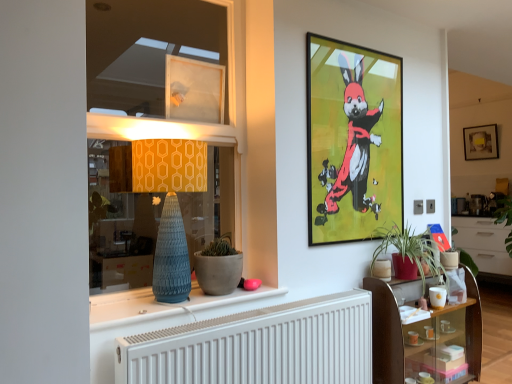
What do you see at coordinates (154, 104) in the screenshot? The height and width of the screenshot is (384, 512). I see `matte yellow fabric at left` at bounding box center [154, 104].

Where is `white matte flowerpot at lower right, the 2th flowerpot viewed from the left`? Image resolution: width=512 pixels, height=384 pixels. white matte flowerpot at lower right, the 2th flowerpot viewed from the left is located at coordinates (449, 259).

Measure the distance between point (450, 252) and camera.

Point (450, 252) is 2.44 meters from camera.

This screenshot has width=512, height=384. Identify the location of matte concrete pot at center, positioned as the 1th flowerpot in front-to-back order. (218, 272).

Find the location of a particular element. matte gold picture frame at upper right, which is counted as the first picture frame, starting from the right is located at coordinates (481, 142).

Considering the positions of objects transparent plastic window at upper center, the third picture frame in the right-to-left sequence, and matte gold picture frame at upper right, which is counted as the first picture frame, starting from the right, in the image provided, who is behind, transparent plastic window at upper center, the third picture frame in the right-to-left sequence, or matte gold picture frame at upper right, which is counted as the first picture frame, starting from the right,?

matte gold picture frame at upper right, which is counted as the first picture frame, starting from the right, is further away from the camera.

From a real-world perspective, between transparent plastic window at upper center, acting as the 3th picture frame starting from the back, and matte gold picture frame at upper right, the third picture frame when ordered from front to back, who is vertically higher?

matte gold picture frame at upper right, the third picture frame when ordered from front to back, from a real-world perspective.

From the picture: Is transparent plastic window at upper center, which is the 1th picture frame from left to right, to the left of matte gold picture frame at upper right, the third picture frame positioned from the left, from the viewer's perspective?

Correct, you'll find transparent plastic window at upper center, which is the 1th picture frame from left to right, to the left of matte gold picture frame at upper right, the third picture frame positioned from the left.

Would you say wooden glass shelf at lower right is inside or outside white matte radiator at lower center?

The correct answer is: outside.

From the image's perspective, is wooden glass shelf at lower right positioned above or below white matte radiator at lower center?

Clearly, from the image's perspective, wooden glass shelf at lower right is below white matte radiator at lower center.

Would you consider wooden glass shelf at lower right to be distant from white matte radiator at lower center?

No.

Is wooden glass shelf at lower right facing towards white matte radiator at lower center?

No, wooden glass shelf at lower right is not turned towards white matte radiator at lower center.

Would you say transparent plastic window at upper center, the third picture frame in the right-to-left sequence, is part of white matte flowerpot at lower right, the first flowerpot viewed from the back,'s contents?

Definitely not — transparent plastic window at upper center, the third picture frame in the right-to-left sequence, is not inside white matte flowerpot at lower right, the first flowerpot viewed from the back.

Considering the relative sizes of white matte flowerpot at lower right, the 2th flowerpot viewed from the left, and transparent plastic window at upper center, acting as the first picture frame starting from the front, in the image provided, is white matte flowerpot at lower right, the 2th flowerpot viewed from the left, bigger than transparent plastic window at upper center, acting as the first picture frame starting from the front,?

No, white matte flowerpot at lower right, the 2th flowerpot viewed from the left, is not bigger than transparent plastic window at upper center, acting as the first picture frame starting from the front.

Does white matte flowerpot at lower right, the first flowerpot viewed from the back, lie behind transparent plastic window at upper center, the third picture frame in the right-to-left sequence?

Yes, it is behind transparent plastic window at upper center, the third picture frame in the right-to-left sequence.

Considering the points (448, 268) and (214, 103), which point is behind, point (448, 268) or point (214, 103)?

Point (448, 268)

Is metallic-framed artwork at upper center, which is the second picture frame in left-to-right order, aimed at transparent plastic window at upper center, acting as the first picture frame starting from the front?

No, metallic-framed artwork at upper center, which is the second picture frame in left-to-right order, is not oriented towards transparent plastic window at upper center, acting as the first picture frame starting from the front.

Where is `picture frame below the transparent plastic window at upper center, acting as the first picture frame starting from the front (from a real-world perspective)`? This screenshot has height=384, width=512. picture frame below the transparent plastic window at upper center, acting as the first picture frame starting from the front (from a real-world perspective) is located at coordinates (352, 140).

From the image's perspective, which one is positioned higher, metallic-framed artwork at upper center, the 2th picture frame from the front, or transparent plastic window at upper center, acting as the first picture frame starting from the front?

transparent plastic window at upper center, acting as the first picture frame starting from the front.

Considering their positions, is metallic-framed artwork at upper center, which is the second picture frame in left-to-right order, located in front of or behind transparent plastic window at upper center, acting as the 3th picture frame starting from the back?

metallic-framed artwork at upper center, which is the second picture frame in left-to-right order, is positioned farther from the viewer than transparent plastic window at upper center, acting as the 3th picture frame starting from the back.

Is point (136, 168) closer to camera compared to point (308, 111)?

Yes, it is in front of point (308, 111).

In terms of height, does matte yellow fabric at left look taller or shorter compared to metallic-framed artwork at upper center, the 2th picture frame from the front?

Considering their sizes, matte yellow fabric at left has more height than metallic-framed artwork at upper center, the 2th picture frame from the front.

Between matte yellow fabric at left and metallic-framed artwork at upper center, placed as the second picture frame when sorted from back to front, which one has smaller size?

metallic-framed artwork at upper center, placed as the second picture frame when sorted from back to front, is smaller.

Is metallic-framed artwork at upper center, which is the second picture frame in left-to-right order, at the back of matte yellow fabric at left?

matte yellow fabric at left does not have its back to metallic-framed artwork at upper center, which is the second picture frame in left-to-right order.

How many degrees apart are the facing directions of matte gold picture frame at upper right, the 1th picture frame in the back-to-front sequence, and white matte radiator at lower center?

89.4 degrees.

Can you confirm if matte gold picture frame at upper right, the third picture frame positioned from the left, is positioned to the right of white matte radiator at lower center?

Yes, matte gold picture frame at upper right, the third picture frame positioned from the left, is to the right of white matte radiator at lower center.

From the image's perspective, relative to white matte radiator at lower center, is matte gold picture frame at upper right, which is counted as the first picture frame, starting from the right, above or below?

From the image's perspective, matte gold picture frame at upper right, which is counted as the first picture frame, starting from the right, appears above white matte radiator at lower center.

Would you say matte gold picture frame at upper right, the third picture frame positioned from the left, is outside white matte radiator at lower center?

matte gold picture frame at upper right, the third picture frame positioned from the left, lies outside white matte radiator at lower center's area.

In terms of height, does matte blue vase at center look taller or shorter compared to matte concrete pot at center, positioned as the 1th flowerpot in front-to-back order?

Considering their sizes, matte blue vase at center has less height than matte concrete pot at center, positioned as the 1th flowerpot in front-to-back order.

Is matte blue vase at center next to matte concrete pot at center, which appears as the 2th flowerpot when viewed from the back?

No, matte blue vase at center is not with matte concrete pot at center, which appears as the 2th flowerpot when viewed from the back.

Can we say matte blue vase at center lies outside matte concrete pot at center, which appears as the 2th flowerpot when viewed from the back?

matte blue vase at center lies outside matte concrete pot at center, which appears as the 2th flowerpot when viewed from the back,'s area.

From a real-world perspective, is matte blue vase at center physically located above or below matte concrete pot at center, the 2th flowerpot when ordered from right to left?

Clearly, from a real-world perspective, matte blue vase at center is below matte concrete pot at center, the 2th flowerpot when ordered from right to left.

From a real-world perspective, starting from the matte gold picture frame at upper right, which is counted as the first picture frame, starting from the right, which picture frame is the 1st one below it? Please provide its 2D coordinates.

[(194, 90)]

You are a GUI agent. You are given a task and a screenshot of the screen. Output one action in this format:
    pyautogui.click(x=<x>, y=<y>)
    Task: Click on the radiator that is above the wooden glass shelf at lower right (from a real-world perspective)
    Image resolution: width=512 pixels, height=384 pixels.
    Given the screenshot: What is the action you would take?
    pyautogui.click(x=259, y=346)

Based on their spatial positions, is matte blue vase at center or matte concrete pot at center, positioned as the 1th flowerpot in front-to-back order, further from matte blue vase at center?

Based on the image, matte blue vase at center appears to be further to matte blue vase at center.

When comparing their distances from matte blue vase at center, does matte blue vase at center or matte gold picture frame at upper right, which is counted as the first picture frame, starting from the right, seem further?

matte gold picture frame at upper right, which is counted as the first picture frame, starting from the right.

When comparing their distances from white matte radiator at lower center, does wooden glass shelf at lower right or metallic-framed artwork at upper center, placed as the second picture frame when sorted from back to front, seem closer?

Among the two, metallic-framed artwork at upper center, placed as the second picture frame when sorted from back to front, is located nearer to white matte radiator at lower center.

Considering their positions, is white matte flowerpot at lower right, the first flowerpot viewed from the back, positioned closer to matte yellow fabric at left than matte concrete pot at center, positioned as the 1th flowerpot in front-to-back order?

The object closer to matte yellow fabric at left is matte concrete pot at center, positioned as the 1th flowerpot in front-to-back order.

Which object lies further to the anchor point transparent plastic window at upper center, the third picture frame in the right-to-left sequence, white matte radiator at lower center or matte yellow fabric at left?

white matte radiator at lower center is further to transparent plastic window at upper center, the third picture frame in the right-to-left sequence.

From the image, which object appears to be nearer to metallic-framed artwork at upper center, which is the second picture frame in left-to-right order, matte blue vase at center or white matte radiator at lower center?

white matte radiator at lower center lies closer to metallic-framed artwork at upper center, which is the second picture frame in left-to-right order, than the other object.

From the image, which object appears to be farther from matte blue vase at center, metallic-framed artwork at upper center, placed as the second picture frame when sorted from back to front, or matte concrete pot at center, which appears as the 2th flowerpot when viewed from the back?

metallic-framed artwork at upper center, placed as the second picture frame when sorted from back to front, lies further to matte blue vase at center than the other object.

Estimate the real-world distances between objects in this image. Which object is closer to matte blue vase at center, white matte flowerpot at lower right, which appears as the second flowerpot when viewed from the front, or matte gold picture frame at upper right, the 1th picture frame in the back-to-front sequence?

white matte flowerpot at lower right, which appears as the second flowerpot when viewed from the front.

Where is `bay window between transparent plastic window at upper center, acting as the 3th picture frame starting from the back, and matte concrete pot at center, the 2th flowerpot when ordered from right to left, from top to bottom`? This screenshot has width=512, height=384. bay window between transparent plastic window at upper center, acting as the 3th picture frame starting from the back, and matte concrete pot at center, the 2th flowerpot when ordered from right to left, from top to bottom is located at coordinates click(x=154, y=104).

The width and height of the screenshot is (512, 384). Find the location of `shelf located between transparent plastic window at upper center, acting as the 3th picture frame starting from the back, and matte gold picture frame at upper right, which is counted as the first picture frame, starting from the right, in the depth direction`. shelf located between transparent plastic window at upper center, acting as the 3th picture frame starting from the back, and matte gold picture frame at upper right, which is counted as the first picture frame, starting from the right, in the depth direction is located at coordinates (421, 333).

Where is `picture frame located between matte yellow fabric at left and metallic-framed artwork at upper center, positioned as the 2th picture frame in right-to-left order, in the left-right direction`? picture frame located between matte yellow fabric at left and metallic-framed artwork at upper center, positioned as the 2th picture frame in right-to-left order, in the left-right direction is located at coordinates (194, 90).

This screenshot has width=512, height=384. In order to click on window sill between matte yellow fabric at left and white matte radiator at lower center in the up-down direction in this screenshot , I will do `click(163, 306)`.